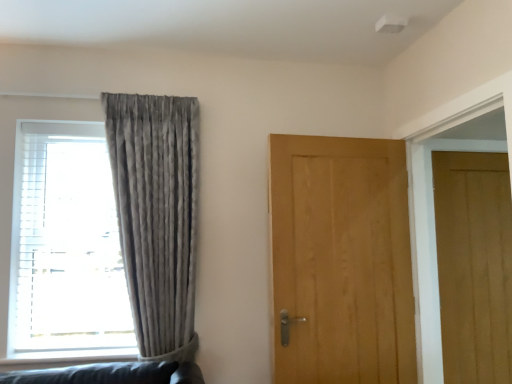
Question: Is light brown wood door at right, which is the second door in left-to-right order, facing away from light brown wood door at center, acting as the 2th door starting from the back?

Choices:
 (A) no
 (B) yes

Answer: (A)

Question: Does light brown wood door at right, which is the second door in left-to-right order, touch light brown wood door at center, positioned as the 1th door in front-to-back order?

Choices:
 (A) yes
 (B) no

Answer: (B)

Question: Is light brown wood door at right, the second door positioned from the front, closer to camera compared to light brown wood door at center, acting as the 2th door starting from the back?

Choices:
 (A) no
 (B) yes

Answer: (A)

Question: Is light brown wood door at right, marked as the 1th door in a right-to-left arrangement, far away from light brown wood door at center, positioned as the 1th door in front-to-back order?

Choices:
 (A) yes
 (B) no

Answer: (B)

Question: Does light brown wood door at right, marked as the 1th door in a right-to-left arrangement, have a larger size compared to light brown wood door at center, placed as the 1th door when sorted from left to right?

Choices:
 (A) yes
 (B) no

Answer: (B)

Question: Could you tell me if light brown wood door at right, acting as the first door starting from the back, is turned towards light brown wood door at center, positioned as the 1th door in front-to-back order?

Choices:
 (A) no
 (B) yes

Answer: (A)

Question: Can you see matte gray curtain at left touching light brown wood door at center, positioned as the 1th door in front-to-back order?

Choices:
 (A) yes
 (B) no

Answer: (B)

Question: Considering the relative sizes of matte gray curtain at left and light brown wood door at center, which is the second door from right to left, in the image provided, is matte gray curtain at left wider than light brown wood door at center, which is the second door from right to left,?

Choices:
 (A) yes
 (B) no

Answer: (A)

Question: Is matte gray curtain at left in front of light brown wood door at center, positioned as the 1th door in front-to-back order?

Choices:
 (A) no
 (B) yes

Answer: (A)

Question: Is matte gray curtain at left aimed at light brown wood door at center, placed as the 1th door when sorted from left to right?

Choices:
 (A) yes
 (B) no

Answer: (B)

Question: From a real-world perspective, does matte gray curtain at left sit lower than light brown wood door at center, which is the second door from right to left?

Choices:
 (A) no
 (B) yes

Answer: (A)

Question: Can you confirm if matte gray curtain at left is taller than light brown wood door at center, positioned as the 1th door in front-to-back order?

Choices:
 (A) yes
 (B) no

Answer: (A)

Question: Does light brown wood door at center, placed as the 1th door when sorted from left to right, have a larger size compared to satin grey curtain at left?

Choices:
 (A) no
 (B) yes

Answer: (A)